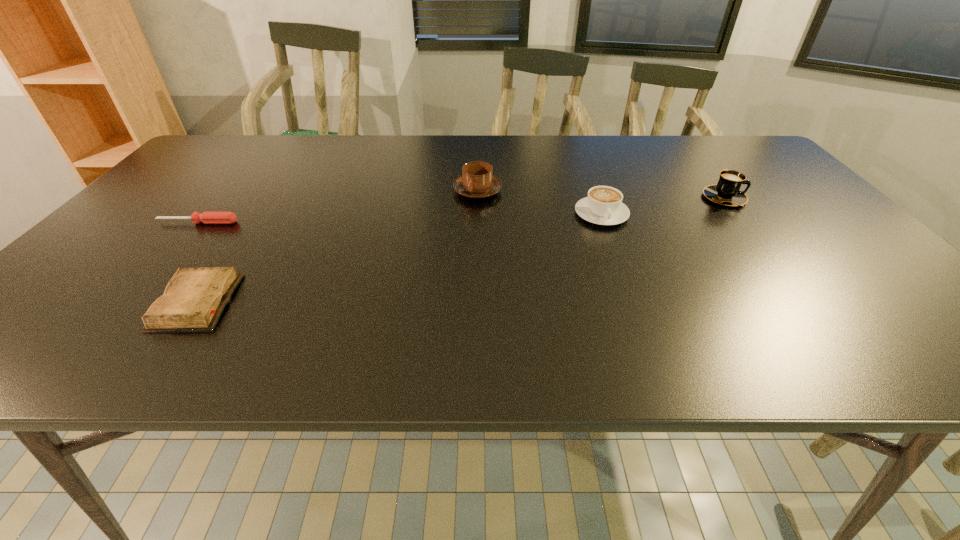
Identify the location of vacant space that's between the screwdriver and the fourth object from left to right. (399, 218).

Image resolution: width=960 pixels, height=540 pixels. What are the coordinates of `free space between the screwdriver and the diary` in the screenshot? It's located at (197, 262).

You are a GUI agent. You are given a task and a screenshot of the screen. Output one action in this format:
    pyautogui.click(x=<x>, y=<y>)
    Task: Click on the vacant point located between the second cappuccino from right to left and the nearest object
    
    Given the screenshot: What is the action you would take?
    pyautogui.click(x=398, y=258)

Find the location of `vacant region between the rightmost cappuccino and the screwdriver`. vacant region between the rightmost cappuccino and the screwdriver is located at coordinates (461, 210).

Identify the location of vacant area that lies between the screwdriver and the fourth object from left to right. The height and width of the screenshot is (540, 960). [399, 218].

The height and width of the screenshot is (540, 960). Identify the location of vacant region between the second cappuccino from right to left and the nearest object. (398, 258).

Image resolution: width=960 pixels, height=540 pixels. I want to click on object that is the fourth closest to the diary, so click(x=727, y=192).

Locate an element on the screen. This screenshot has width=960, height=540. the fourth closest object to the shortest cappuccino is located at coordinates (206, 217).

What are the coordinates of `cappuccino that is the second closest one to the rightmost object` in the screenshot? It's located at (477, 181).

Select which cappuccino appears as the closest to the rightmost cappuccino. Please provide its 2D coordinates. Your answer should be formatted as a tuple, i.e. [(x, y)], where the tuple contains the x and y coordinates of a point satisfying the conditions above.

[(603, 205)]